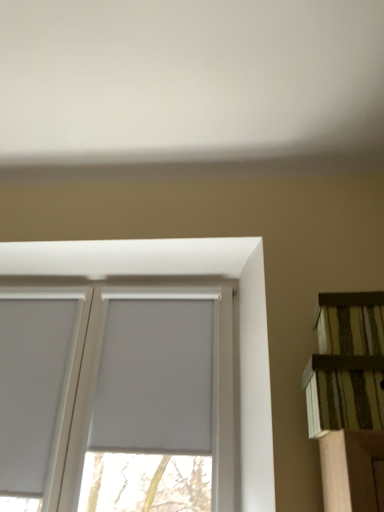
Question: Is white matte window screen at center at the right side of white matte window at center?

Choices:
 (A) yes
 (B) no

Answer: (A)

Question: Is white matte window screen at center aimed at white matte window at center?

Choices:
 (A) no
 (B) yes

Answer: (B)

Question: Is white matte window screen at center positioned behind white matte window at center?

Choices:
 (A) yes
 (B) no

Answer: (A)

Question: Is white matte window screen at center taller than white matte window at center?

Choices:
 (A) no
 (B) yes

Answer: (A)

Question: Considering the relative positions of white matte window screen at center and white matte window at center in the image provided, is white matte window screen at center to the left of white matte window at center from the viewer's perspective?

Choices:
 (A) no
 (B) yes

Answer: (A)

Question: Is white matte window screen at center to the left or to the right of white matte window at center in the image?

Choices:
 (A) right
 (B) left

Answer: (A)

Question: From a real-world perspective, is white matte window screen at center above or below white matte window at center?

Choices:
 (A) above
 (B) below

Answer: (A)

Question: In the image, is white matte window screen at center positioned in front of or behind white matte window at center?

Choices:
 (A) behind
 (B) front

Answer: (A)

Question: Considering the positions of white matte window screen at center and white matte window at center in the image, is white matte window screen at center bigger or smaller than white matte window at center?

Choices:
 (A) big
 (B) small

Answer: (B)

Question: From a real-world perspective, is striped fabric shelf at right positioned above or below white matte window at center?

Choices:
 (A) below
 (B) above

Answer: (A)

Question: Considering their positions, is striped fabric shelf at right located in front of or behind white matte window at center?

Choices:
 (A) behind
 (B) front

Answer: (B)

Question: Looking at the image, does striped fabric shelf at right seem bigger or smaller compared to white matte window at center?

Choices:
 (A) small
 (B) big

Answer: (A)

Question: In terms of width, does striped fabric shelf at right look wider or thinner when compared to white matte window at center?

Choices:
 (A) thin
 (B) wide

Answer: (B)

Question: From a real-world perspective, is striped fabric shelf at right above or below white matte window screen at center?

Choices:
 (A) above
 (B) below

Answer: (B)

Question: Is point (334, 356) positioned closer to the camera than point (117, 378)?

Choices:
 (A) closer
 (B) farther

Answer: (A)